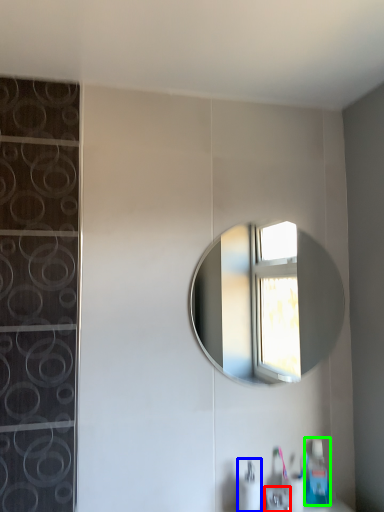
Question: Based on their relative distances, which object is nearer to faucet (highlighted by a red box)? Choose from soap dispenser (highlighted by a blue box) and soap dispenser (highlighted by a green box).

Choices:
 (A) soap dispenser
 (B) soap dispenser

Answer: (A)